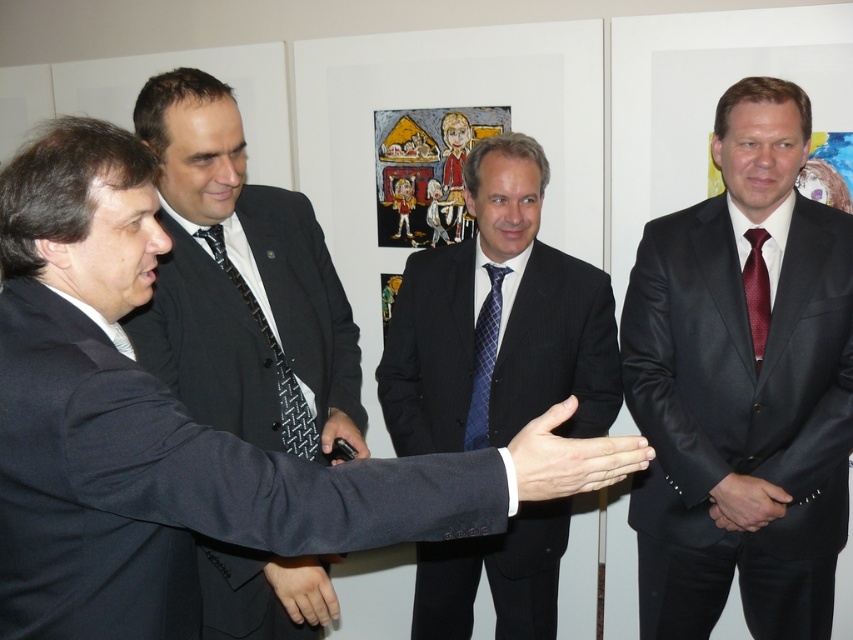
You are standing in the room and see the black textured suit at left and the pinstriped suit at center. Which one is higher up in the image?

The black textured suit at left is located above the pinstriped suit at center, so it is higher up in the image.

You are an interior designer observing the scene. You notice the white matte hand at center and the black woven tie at center. Which object is shorter in height?

The white matte hand at center is shorter than the black woven tie at center.